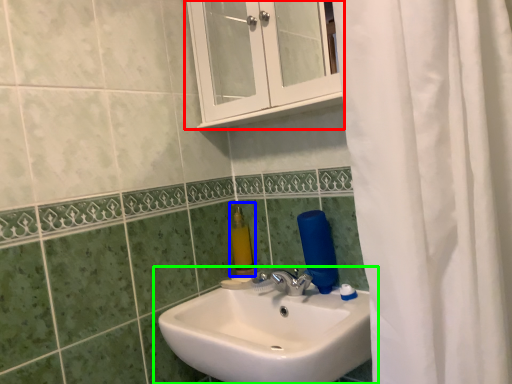
Question: Based on their relative distances, which object is nearer to medicine cabinet (highlighted by a red box)? Choose from soap dispenser (highlighted by a blue box) and sink (highlighted by a green box).

Choices:
 (A) soap dispenser
 (B) sink

Answer: (A)